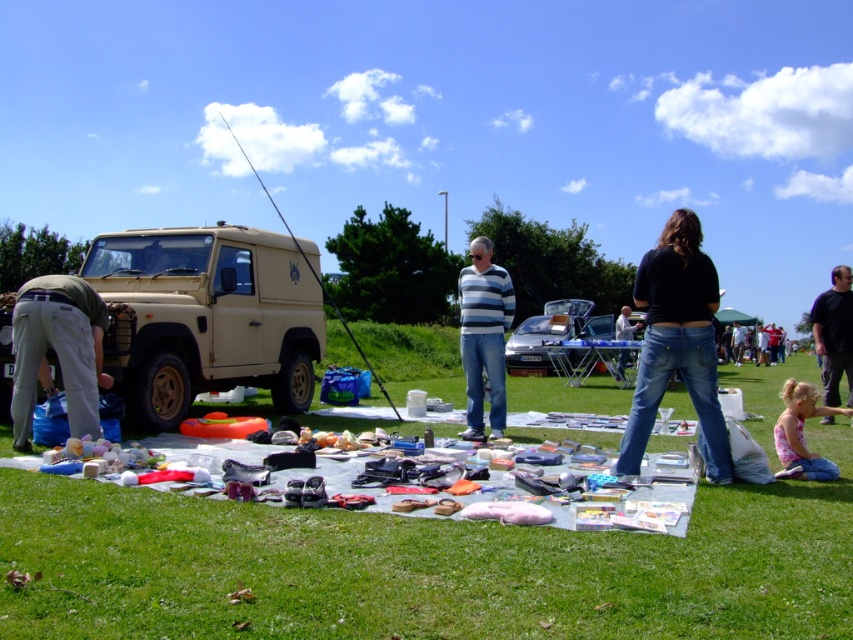
Question: Is green cotton pants at lower left wider than beige matte fishing pole at center?

Choices:
 (A) yes
 (B) no

Answer: (B)

Question: Can you confirm if matte beige jeep at left is bigger than beige matte fishing pole at center?

Choices:
 (A) no
 (B) yes

Answer: (A)

Question: Which point is farther to the camera?

Choices:
 (A) (68, 413)
 (B) (784, 433)

Answer: (A)

Question: Is striped sweater at center to the right of denim jeans at center from the viewer's perspective?

Choices:
 (A) yes
 (B) no

Answer: (B)

Question: Which point is farther to the camera?

Choices:
 (A) green grass at lower center
 (B) striped sweater at center
 (C) black denim jeans at center

Answer: (B)

Question: Estimate the real-world distances between objects in this image. Which object is farther from the matte beige jeep at left?

Choices:
 (A) striped sweater at center
 (B) black denim jeans at center
 (C) green cotton pants at lower left
 (D) green grass at lower center

Answer: (B)